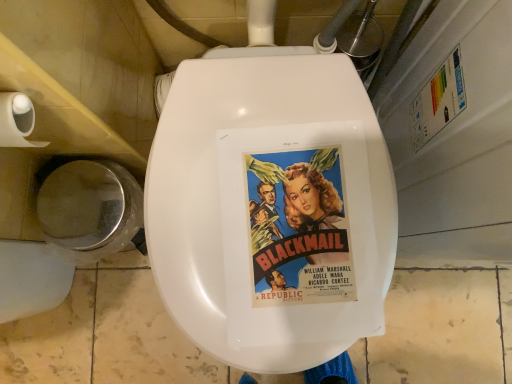
Question: Are white matte toilet paper at left and vivid paper movie poster at center located far from each other?

Choices:
 (A) yes
 (B) no

Answer: (B)

Question: Can you confirm if white matte toilet paper at left is positioned to the right of vivid paper movie poster at center?

Choices:
 (A) no
 (B) yes

Answer: (A)

Question: Can you confirm if white matte toilet paper at left is smaller than vivid paper movie poster at center?

Choices:
 (A) yes
 (B) no

Answer: (B)

Question: Considering the relative sizes of white matte toilet paper at left and vivid paper movie poster at center in the image provided, is white matte toilet paper at left shorter than vivid paper movie poster at center?

Choices:
 (A) no
 (B) yes

Answer: (A)

Question: Does white matte toilet paper at left appear on the left side of vivid paper movie poster at center?

Choices:
 (A) yes
 (B) no

Answer: (A)

Question: Considering the positions of vivid paper movie poster at center and shiny metallic toilet bowl at lower left in the image, is vivid paper movie poster at center wider or thinner than shiny metallic toilet bowl at lower left?

Choices:
 (A) wide
 (B) thin

Answer: (A)

Question: From a real-world perspective, is vivid paper movie poster at center above or below shiny metallic toilet bowl at lower left?

Choices:
 (A) below
 (B) above

Answer: (B)

Question: Considering their positions, is vivid paper movie poster at center located in front of or behind shiny metallic toilet bowl at lower left?

Choices:
 (A) behind
 (B) front

Answer: (B)

Question: Is vivid paper movie poster at center bigger or smaller than shiny metallic toilet bowl at lower left?

Choices:
 (A) small
 (B) big

Answer: (A)

Question: From a real-world perspective, relative to shiny metallic toilet bowl at lower left, is white matte toilet paper at left vertically above or below?

Choices:
 (A) below
 (B) above

Answer: (B)

Question: Is white matte toilet paper at left inside the boundaries of shiny metallic toilet bowl at lower left, or outside?

Choices:
 (A) outside
 (B) inside

Answer: (A)

Question: Is white matte toilet paper at left wider or thinner than shiny metallic toilet bowl at lower left?

Choices:
 (A) wide
 (B) thin

Answer: (B)

Question: In terms of size, does white matte toilet paper at left appear bigger or smaller than shiny metallic toilet bowl at lower left?

Choices:
 (A) big
 (B) small

Answer: (B)

Question: Considering the relative positions of shiny metallic toilet bowl at lower left and white matte toilet paper at left in the image provided, is shiny metallic toilet bowl at lower left to the left or to the right of white matte toilet paper at left?

Choices:
 (A) left
 (B) right

Answer: (A)

Question: Is shiny metallic toilet bowl at lower left inside the boundaries of white matte toilet paper at left, or outside?

Choices:
 (A) outside
 (B) inside

Answer: (A)